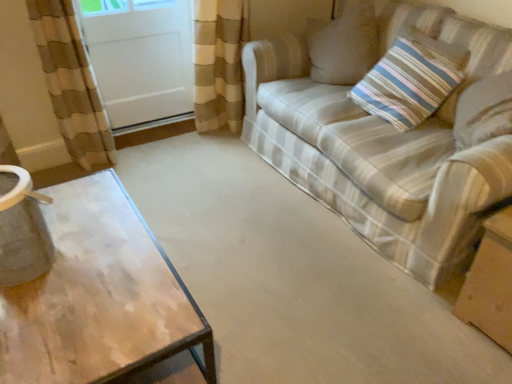
Locate an element on the screen. brown cardboard box at lower right is located at coordinates point(490,283).

The image size is (512, 384). What do you see at coordinates (388, 134) in the screenshot?
I see `striped fabric couch at right` at bounding box center [388, 134].

Identify the location of white glossy screen door at upper left. (140, 57).

Between striped fabric pillow at upper right and striped fabric couch at right, which one has larger size?

With larger size is striped fabric couch at right.

Can you confirm if striped fabric pillow at upper right is thinner than striped fabric couch at right?

Correct, the width of striped fabric pillow at upper right is less than that of striped fabric couch at right.

Is striped fabric pillow at upper right turned away from brown cardboard box at lower right?

No.

From the image's perspective, between striped fabric pillow at upper right and brown cardboard box at lower right, who is located below?

brown cardboard box at lower right.

Which is closer to the camera, (390, 122) or (493, 279)?

Point (390, 122) is farther from the camera than point (493, 279).

In the scene shown: What's the angular difference between striped fabric pillow at upper right and brown cardboard box at lower right's facing directions?

89.1 degrees.

Can you confirm if brown cardboard box at lower right is positioned to the left of white glossy screen door at upper left?

No.

Can we say brown cardboard box at lower right lies outside white glossy screen door at upper left?

Indeed, brown cardboard box at lower right is completely outside white glossy screen door at upper left.

Does brown cardboard box at lower right lie in front of white glossy screen door at upper left?

Yes, brown cardboard box at lower right is closer to the viewer.

Based on the photo, who is taller, striped fabric couch at right or brown cardboard box at lower right?

striped fabric couch at right.

From the image's perspective, is striped fabric couch at right positioned above or below brown cardboard box at lower right?

striped fabric couch at right is situated higher than brown cardboard box at lower right in the image.

From a real-world perspective, who is located lower, striped fabric couch at right or brown cardboard box at lower right?

brown cardboard box at lower right is physically lower.

Between striped fabric couch at right and brown cardboard box at lower right, which one has larger width?

Wider between the two is striped fabric couch at right.

Does white glossy screen door at upper left have a greater height compared to brown cardboard box at lower right?

Correct, white glossy screen door at upper left is much taller as brown cardboard box at lower right.

Consider the image. From the image's perspective, between white glossy screen door at upper left and brown cardboard box at lower right, which one is located above?

From the image's view, white glossy screen door at upper left is above.

Considering the positions of objects white glossy screen door at upper left and brown cardboard box at lower right in the image provided, who is more to the right, white glossy screen door at upper left or brown cardboard box at lower right?

From the viewer's perspective, brown cardboard box at lower right appears more on the right side.

Is the depth of white glossy screen door at upper left greater than that of brown cardboard box at lower right?

Yes.

Does brown cardboard box at lower right have a smaller size compared to striped fabric pillow at upper right?

No.

Which is closer, (493, 245) or (359, 87)?

Point (493, 245) appears to be closer to the viewer than point (359, 87).

Is brown cardboard box at lower right positioned beyond the bounds of striped fabric pillow at upper right?

Absolutely, brown cardboard box at lower right is external to striped fabric pillow at upper right.

This screenshot has height=384, width=512. In the image, there is a striped fabric pillow at upper right. Identify the location of studio couch below it (from a real-world perspective). (388, 134).

In terms of width, does striped fabric couch at right look wider or thinner when compared to striped fabric pillow at upper right?

Clearly, striped fabric couch at right has more width compared to striped fabric pillow at upper right.

From the image's perspective, is striped fabric couch at right located above striped fabric pillow at upper right?

No.

Considering the positions of objects striped fabric couch at right and striped fabric pillow at upper right in the image provided, who is more to the left, striped fabric couch at right or striped fabric pillow at upper right?

striped fabric couch at right.

Image resolution: width=512 pixels, height=384 pixels. Identify the location of pillow above the striped fabric couch at right (from the image's perspective). (411, 80).

Find the location of a particular element. pillow that appears on the left of brown cardboard box at lower right is located at coordinates 411,80.

From the picture: Looking at the image, which one is located closer to brown cardboard box at lower right, striped fabric couch at right or white glossy screen door at upper left?

striped fabric couch at right lies closer to brown cardboard box at lower right than the other object.

Based on the photo, from the image, which object appears to be nearer to brown cardboard box at lower right, white glossy screen door at upper left or striped fabric couch at right?

→ striped fabric couch at right lies closer to brown cardboard box at lower right than the other object.

Consider the image. Which object lies further to the anchor point striped fabric pillow at upper right, brown cardboard box at lower right or white glossy screen door at upper left?

Based on the image, white glossy screen door at upper left appears to be further to striped fabric pillow at upper right.

When comparing their distances from brown cardboard box at lower right, does striped fabric pillow at upper right or striped fabric couch at right seem further?

striped fabric pillow at upper right is positioned further to the anchor brown cardboard box at lower right.

Estimate the real-world distances between objects in this image. Which object is further from striped fabric couch at right, striped fabric pillow at upper right or brown cardboard box at lower right?

Among the two, brown cardboard box at lower right is located further to striped fabric couch at right.

Looking at this image, from the image, which object appears to be farther from white glossy screen door at upper left, brown cardboard box at lower right or striped fabric couch at right?

brown cardboard box at lower right.

Based on their spatial positions, is white glossy screen door at upper left or striped fabric pillow at upper right further from striped fabric couch at right?

white glossy screen door at upper left lies further to striped fabric couch at right than the other object.

Estimate the real-world distances between objects in this image. Which object is further from white glossy screen door at upper left, striped fabric pillow at upper right or brown cardboard box at lower right?

The object further to white glossy screen door at upper left is brown cardboard box at lower right.

Identify the location of studio couch located between white glossy screen door at upper left and brown cardboard box at lower right in the left-right direction. The width and height of the screenshot is (512, 384). (388, 134).

You are a GUI agent. You are given a task and a screenshot of the screen. Output one action in this format:
    pyautogui.click(x=<x>, y=<y>)
    Task: Click on the studio couch between striped fabric pillow at upper right and brown cardboard box at lower right from top to bottom
    The image size is (512, 384).
    Given the screenshot: What is the action you would take?
    pyautogui.click(x=388, y=134)

You are a GUI agent. You are given a task and a screenshot of the screen. Output one action in this format:
    pyautogui.click(x=<x>, y=<y>)
    Task: Click on the studio couch between white glossy screen door at upper left and striped fabric pillow at upper right
    The height and width of the screenshot is (384, 512).
    Given the screenshot: What is the action you would take?
    pyautogui.click(x=388, y=134)

The height and width of the screenshot is (384, 512). I want to click on pillow between white glossy screen door at upper left and brown cardboard box at lower right from left to right, so click(411, 80).